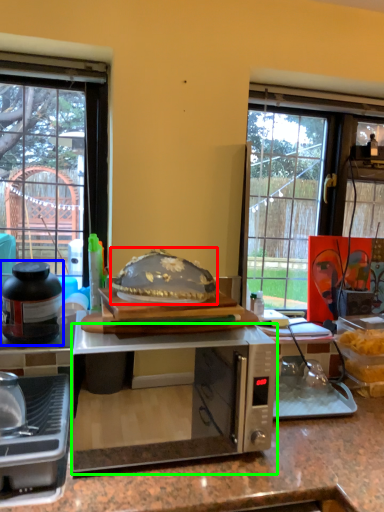
Question: Considering the real-world distances, which object is closest to food (highlighted by a red box)? kitchen appliance (highlighted by a blue box) or microwave oven (highlighted by a green box).

Choices:
 (A) kitchen appliance
 (B) microwave oven

Answer: (A)